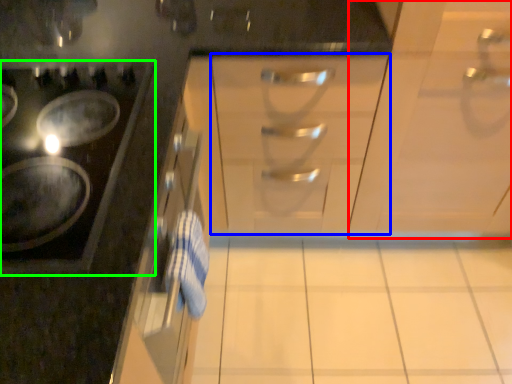
Question: Which object is positioned closest to cabinetry (highlighted by a red box)? Select from drawer (highlighted by a blue box) and gas stove (highlighted by a green box).

Choices:
 (A) drawer
 (B) gas stove

Answer: (A)